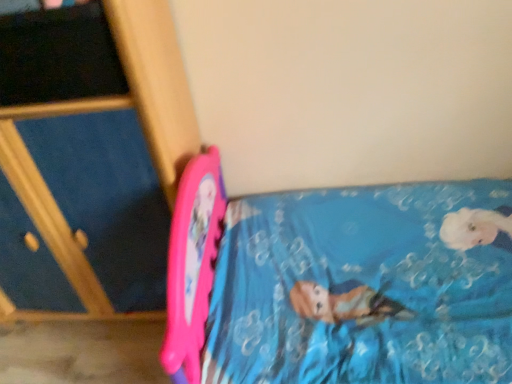
What is the approximate width of pink plastic dresser at lower right?

pink plastic dresser at lower right is 16.42 inches in width.

Describe the element at coordinates (89, 159) in the screenshot. I see `pink plastic dresser at lower right` at that location.

This screenshot has height=384, width=512. Identify the location of pink plastic dresser at lower right. (89, 159).

Image resolution: width=512 pixels, height=384 pixels. Find the location of `pink plastic dresser at lower right`. pink plastic dresser at lower right is located at coordinates (89, 159).